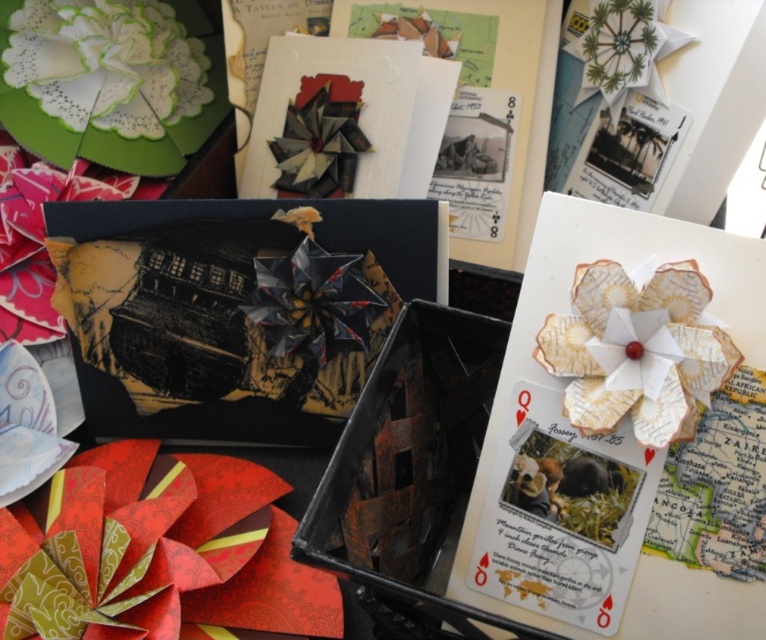
You have a camera that you want to place on the table so that it is exactly 24 inches away from the white paper postcard at center. Based on the current arrangement, is the camera already positioned correctly?

The camera and the white paper postcard at center are currently 23.19 inches apart. Since 23.19 inches is less than 24 inches, the camera is not positioned correctly and needs to be moved further away to meet the 24 inch requirement.

You are arranging origami flowers on a table and need to place a new flower between the map paper flower at upper right and the white paper flower at upper left. What is the minimum distance you need to maintain between these two flowers to ensure the new flower fits?

The map paper flower at upper right and white paper flower at upper left are 27.18 inches apart, so the minimum distance you need to maintain between them to fit a new flower is at least 27.18 inches.